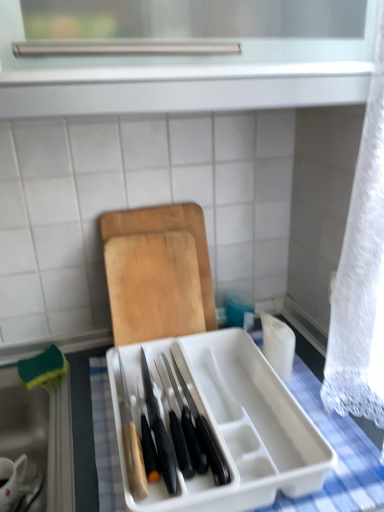
Question: Is white plastic knife block at center behind wooden cutting board at center?

Choices:
 (A) yes
 (B) no

Answer: (B)

Question: Is white plastic knife block at center placed right next to wooden cutting board at center?

Choices:
 (A) yes
 (B) no

Answer: (B)

Question: Is white plastic knife block at center not within wooden cutting board at center?

Choices:
 (A) no
 (B) yes

Answer: (B)

Question: Considering the relative sizes of white plastic knife block at center and wooden cutting board at center in the image provided, is white plastic knife block at center bigger than wooden cutting board at center?

Choices:
 (A) no
 (B) yes

Answer: (B)

Question: From a real-world perspective, is white plastic knife block at center under wooden cutting board at center?

Choices:
 (A) no
 (B) yes

Answer: (B)

Question: From the image's perspective, is white plastic knife block at center beneath wooden cutting board at center?

Choices:
 (A) yes
 (B) no

Answer: (A)

Question: Is white plastic knife block at center completely or partially inside white ceramic mug at lower left?

Choices:
 (A) yes
 (B) no

Answer: (B)

Question: From a real-world perspective, is white ceramic mug at lower left physically above white plastic knife block at center?

Choices:
 (A) yes
 (B) no

Answer: (B)

Question: Is white ceramic mug at lower left closer to camera compared to white plastic knife block at center?

Choices:
 (A) no
 (B) yes

Answer: (A)

Question: Can we say white ceramic mug at lower left lies outside white plastic knife block at center?

Choices:
 (A) no
 (B) yes

Answer: (B)

Question: Does white ceramic mug at lower left lie behind white plastic knife block at center?

Choices:
 (A) yes
 (B) no

Answer: (A)

Question: Does white ceramic mug at lower left have a greater width compared to white plastic knife block at center?

Choices:
 (A) no
 (B) yes

Answer: (A)

Question: Is white plastic knife block at center to the left of white ceramic mug at lower left from the viewer's perspective?

Choices:
 (A) yes
 (B) no

Answer: (B)